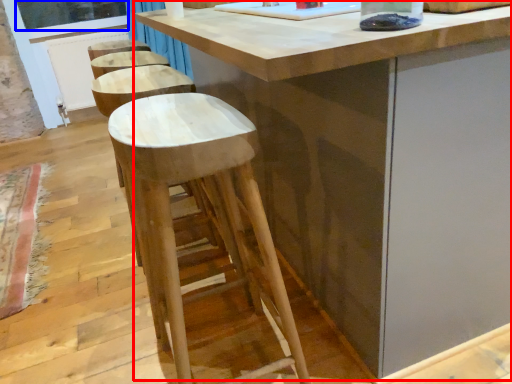
Question: Which object appears farthest to the camera in this image, table (highlighted by a red box) or window screen (highlighted by a blue box)?

Choices:
 (A) table
 (B) window screen

Answer: (B)